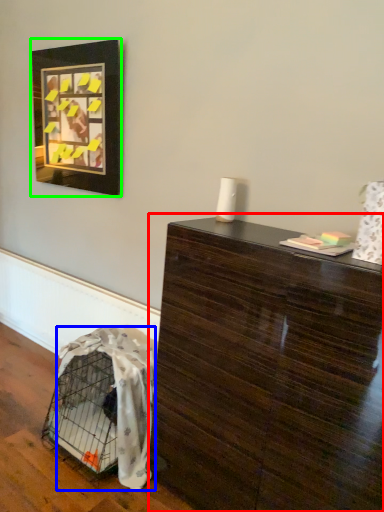
Question: Based on their relative distances, which object is nearer to table (highlighted by a red box)? Choose from blanket (highlighted by a blue box) and picture frame (highlighted by a green box).

Choices:
 (A) blanket
 (B) picture frame

Answer: (A)